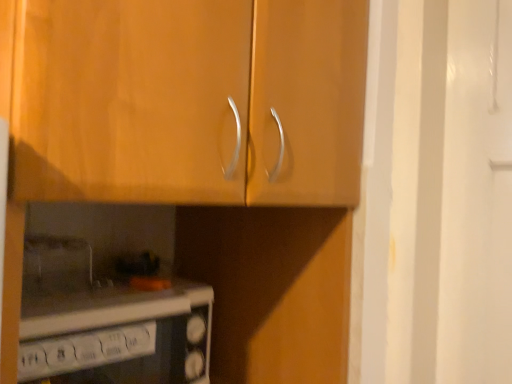
Question: Is wooden cabinet at upper center in front of or behind white glossy microwave at lower left in the image?

Choices:
 (A) behind
 (B) front

Answer: (B)

Question: Is wooden cabinet at upper center wider or thinner than white glossy microwave at lower left?

Choices:
 (A) wide
 (B) thin

Answer: (A)

Question: From a real-world perspective, is wooden cabinet at upper center positioned above or below white glossy microwave at lower left?

Choices:
 (A) below
 (B) above

Answer: (B)

Question: Does point (62, 349) appear closer or farther from the camera than point (312, 132)?

Choices:
 (A) farther
 (B) closer

Answer: (A)

Question: Choose the correct answer: Is white glossy microwave at lower left inside wooden cabinet at upper center or outside it?

Choices:
 (A) inside
 (B) outside

Answer: (B)

Question: Is white glossy microwave at lower left to the left or to the right of wooden cabinet at upper center in the image?

Choices:
 (A) left
 (B) right

Answer: (A)

Question: From the image's perspective, relative to wooden cabinet at upper center, is white glossy microwave at lower left above or below?

Choices:
 (A) above
 (B) below

Answer: (B)